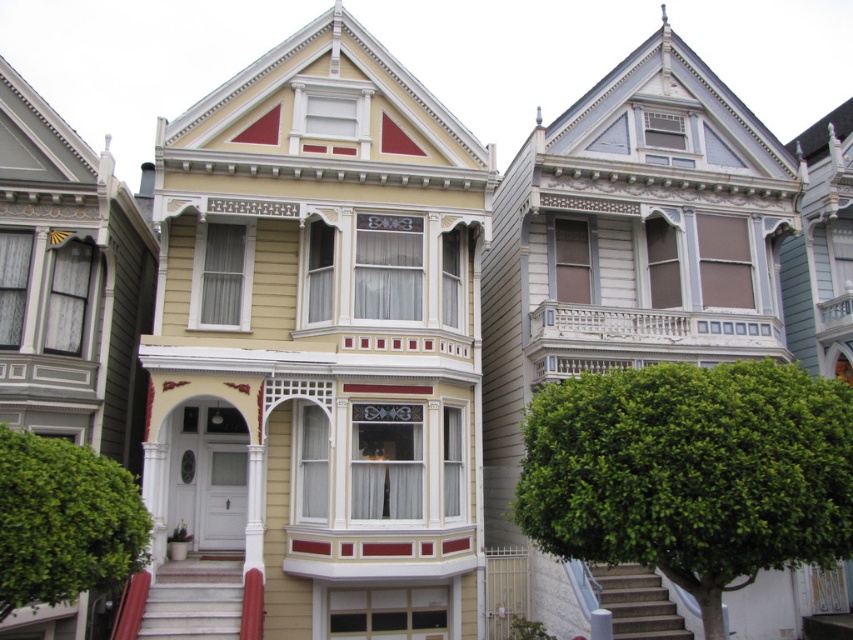
Between white marble stairs at center and white concrete stairs at lower right, which one is positioned higher?

white marble stairs at center is higher up.

Describe the element at coordinates (194, 600) in the screenshot. The image size is (853, 640). I see `white marble stairs at center` at that location.

Image resolution: width=853 pixels, height=640 pixels. I want to click on white marble stairs at center, so click(194, 600).